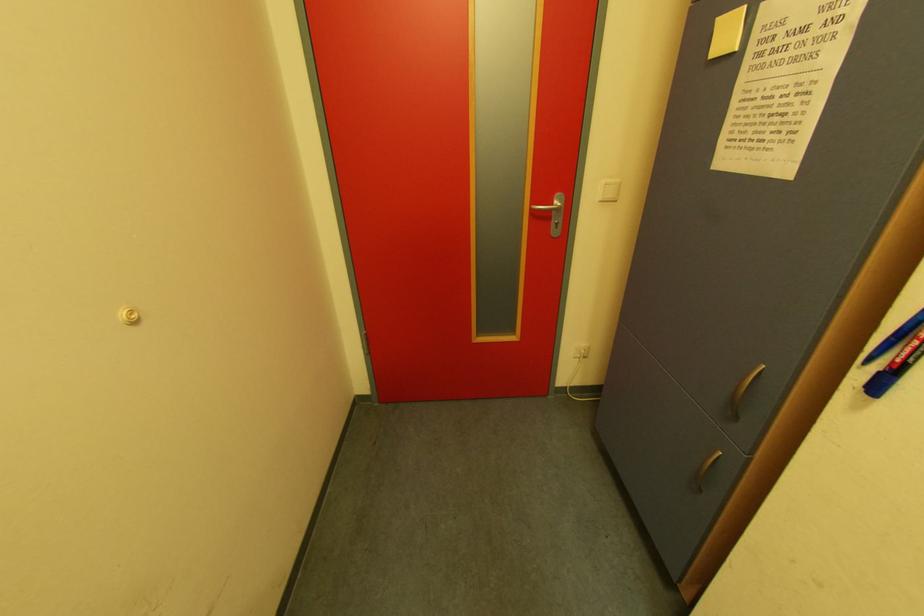
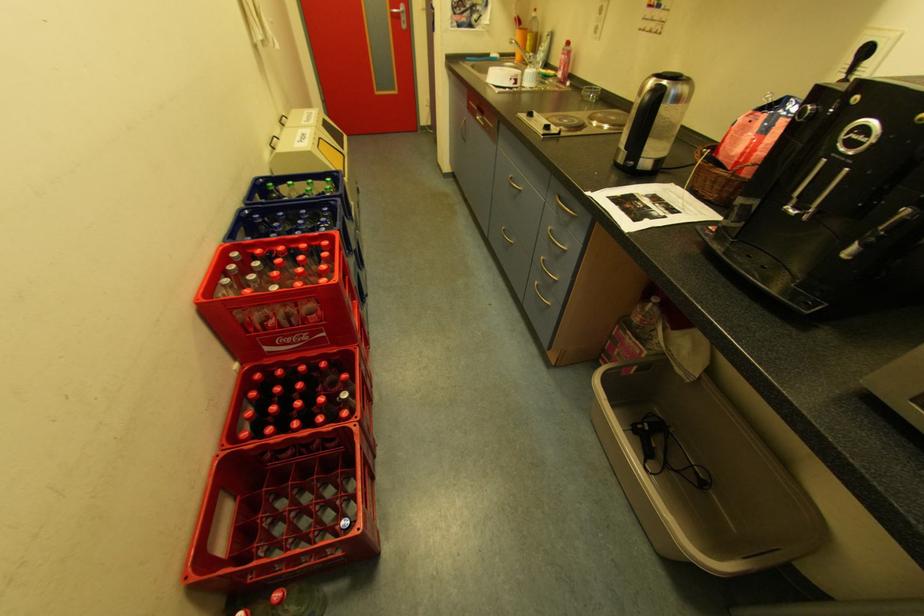
Question: In a continuous first-person perspective shot, in which direction is the camera moving?

Choices:
 (A) Left
 (B) Right
 (C) Forward
 (D) Backward

Answer: (D)